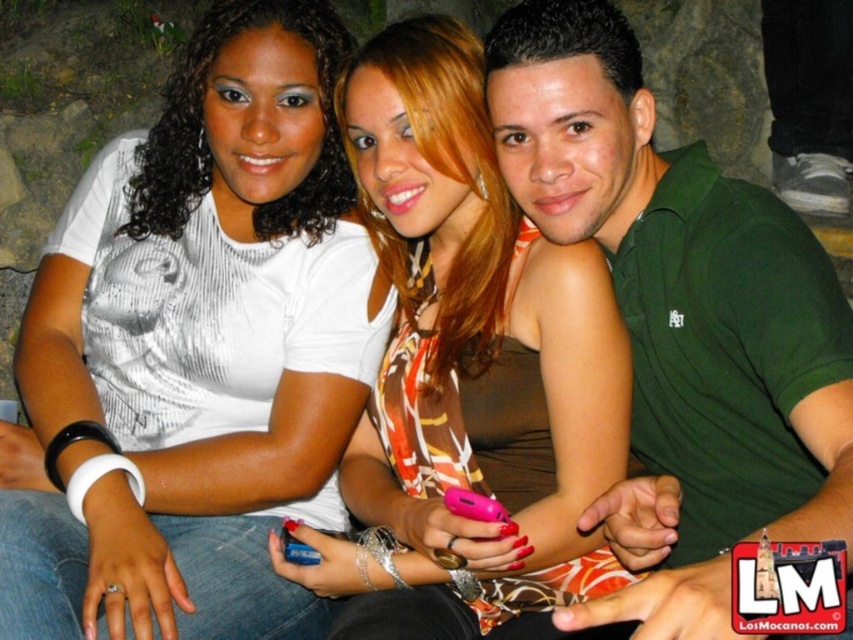
You are a photographer standing at the front of the scene. You need to capture a photo that includes both the white matte shirt at upper left and the printed fabric dress at center. What is the minimum distance you must maintain between the camera and the subjects to ensure both are fully in frame?

The minimum distance you must maintain between the camera and the subjects is 11.76 inches to ensure both the white matte shirt at upper left and the printed fabric dress at center are fully in frame.

You are standing 5 feet away from the printed fabric dress at center and the green matte shirt at center. Can you reach both items without moving your position?

The distance between the printed fabric dress at center and the green matte shirt at center is 10.82 inches, so if you are standing 5 feet away from both, you can reach both items without moving your position since 5 feet is much farther than the 10.82 inches between them.

You are a photographer setting up a wide shot for a group photo. The subjects include the printed fabric dress at center and the green matte shirt at center. Based on their widths, which one should you position closer to the edges of the frame to avoid overcrowding?

The printed fabric dress at center is wider than the green matte shirt at center, so positioning the printed fabric dress at center closer to the edges of the frame would help prevent overcrowding in the shot.